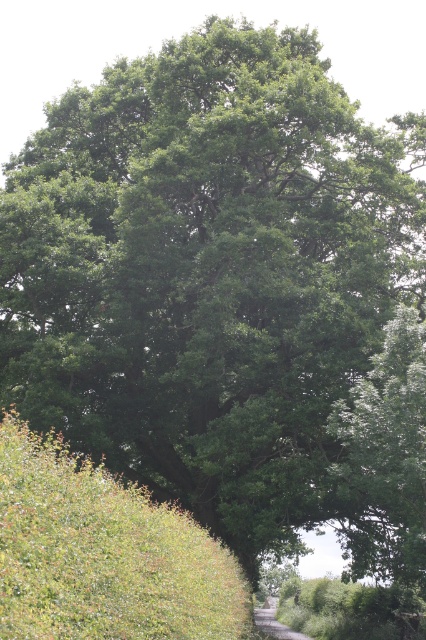
Based on the scene description, what are the coordinates of the green leafy hedge at lower left?

The green leafy hedge at lower left is located at coordinates (103, 554).

You are standing on the gravel path at center and want to walk towards the green leafy hedge at lower left. Is the hedge visible from your current position?

The green leafy hedge at lower left is closer to the viewer than the gravel path at center, so yes, the hedge is visible from your current position on the gravel path at center.

You are walking along the gravel path at center and want to reach the green leafy hedge at lower left. Is the hedge blocking your direct path?

The green leafy hedge at lower left is positioned over the gravel path at center, so it is blocking your direct path.